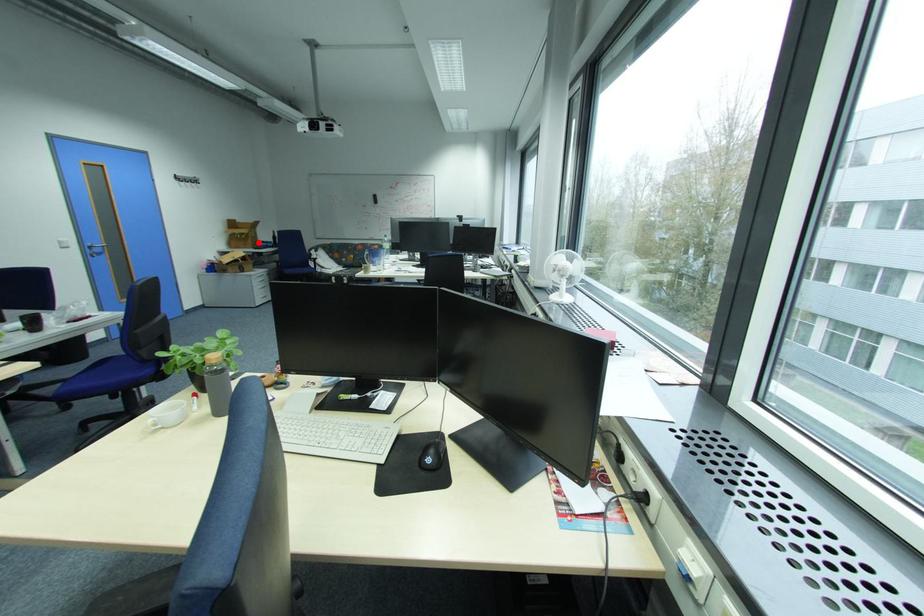
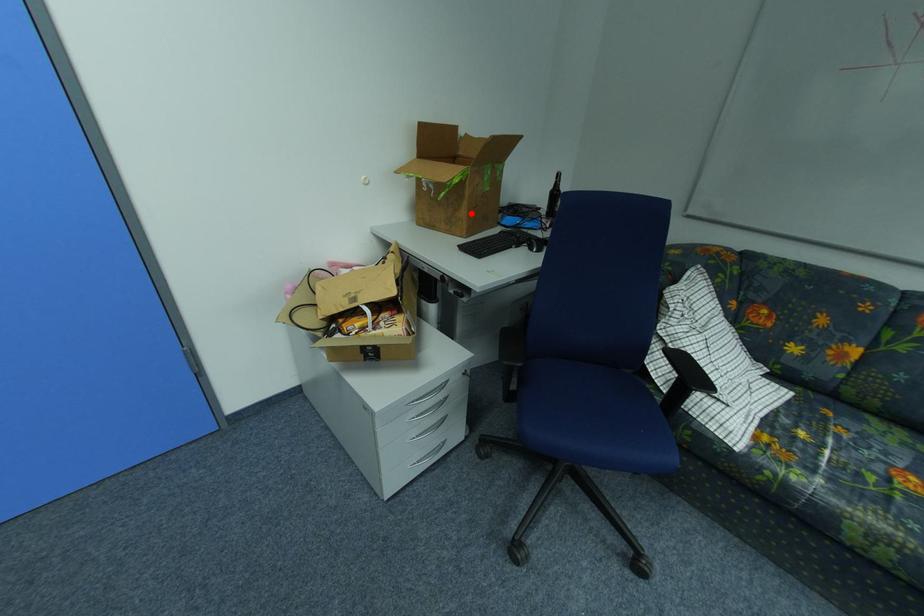
I am providing you with two images of the same scene from different viewpoints. A red point is marked on the first image and another point is marked on the second image. Do the highlighted points in image1 and image2 indicate the same real-world spot?

Yes